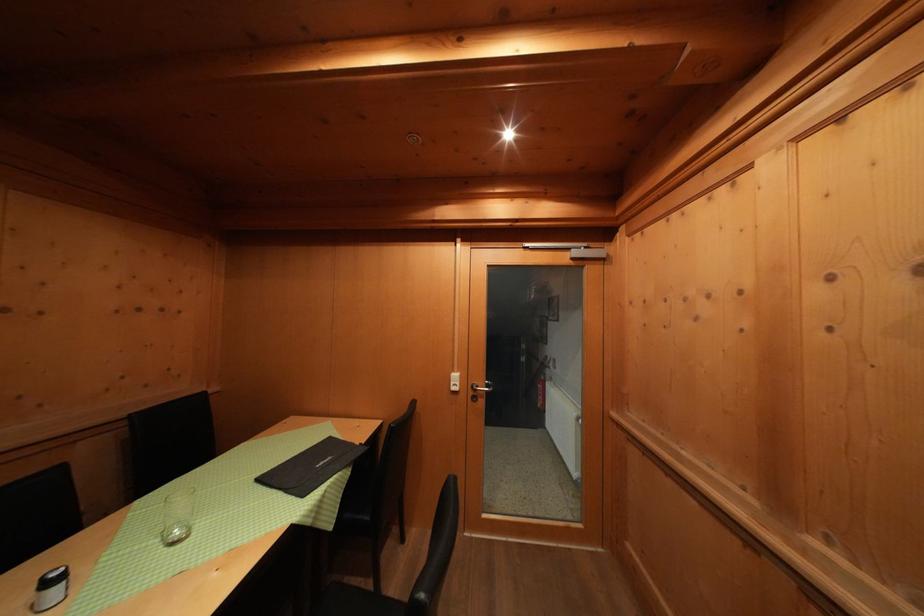
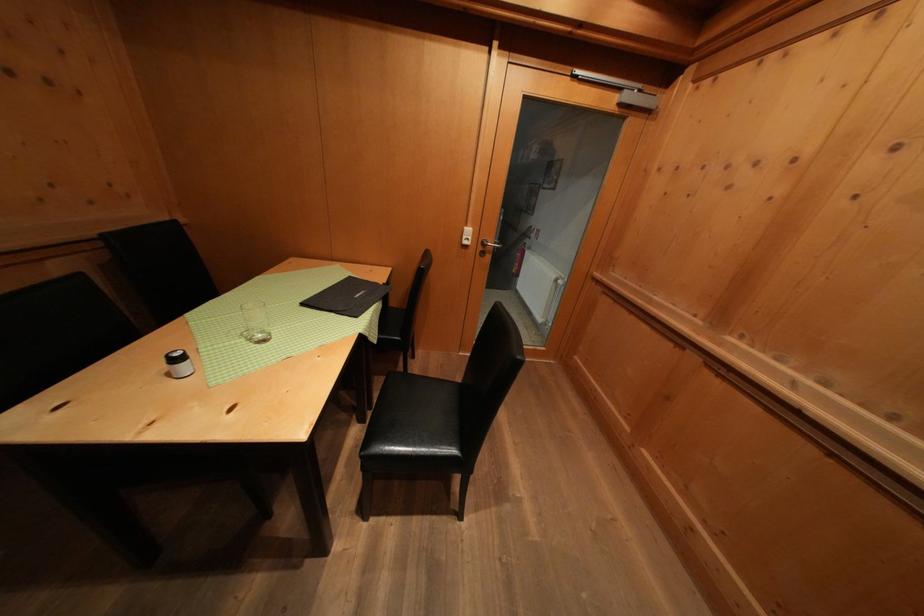
Question: The first image is from the beginning of the video and the second image is from the end. How did the camera likely rotate when shooting the video?

Choices:
 (A) Left
 (B) Right
 (C) Up
 (D) Down

Answer: (D)